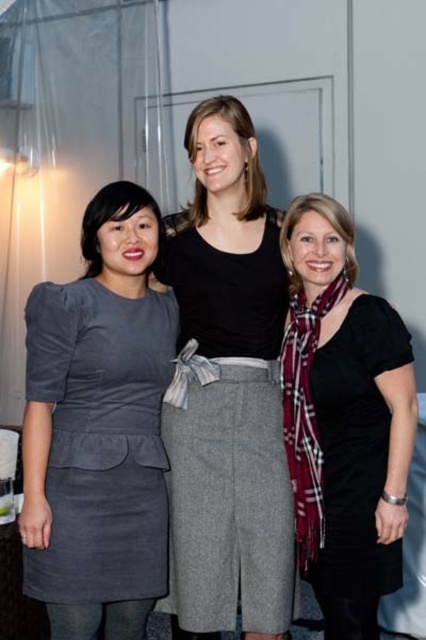
Question: Is plaid scarf at center below gray suede dress at left?

Choices:
 (A) yes
 (B) no

Answer: (B)

Question: Can you confirm if black cotton shirt at center is positioned to the left of plaid scarf at center?

Choices:
 (A) yes
 (B) no

Answer: (A)

Question: Which point appears closest to the camera in this image?

Choices:
 (A) (101, 410)
 (B) (175, 433)

Answer: (A)

Question: Which point is closer to the camera?

Choices:
 (A) plaid scarf at center
 (B) gray suede dress at left
 (C) black cotton shirt at center

Answer: (B)

Question: Is black cotton shirt at center closer to the viewer compared to plaid scarf at center?

Choices:
 (A) no
 (B) yes

Answer: (A)

Question: Which of the following is the farthest from the observer?

Choices:
 (A) (256, 618)
 (B) (359, 484)

Answer: (A)